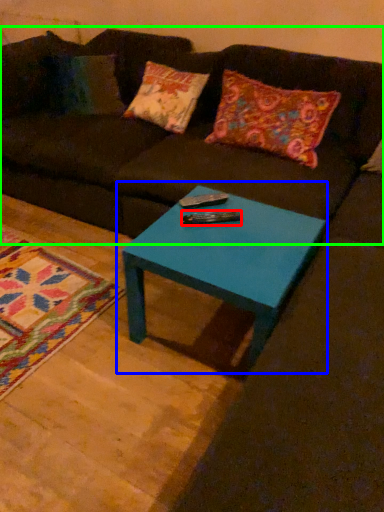
Question: Which object is the farthest from remote (highlighted by a red box)? Choose among these: coffee table (highlighted by a blue box) or studio couch (highlighted by a green box).

Choices:
 (A) coffee table
 (B) studio couch

Answer: (B)